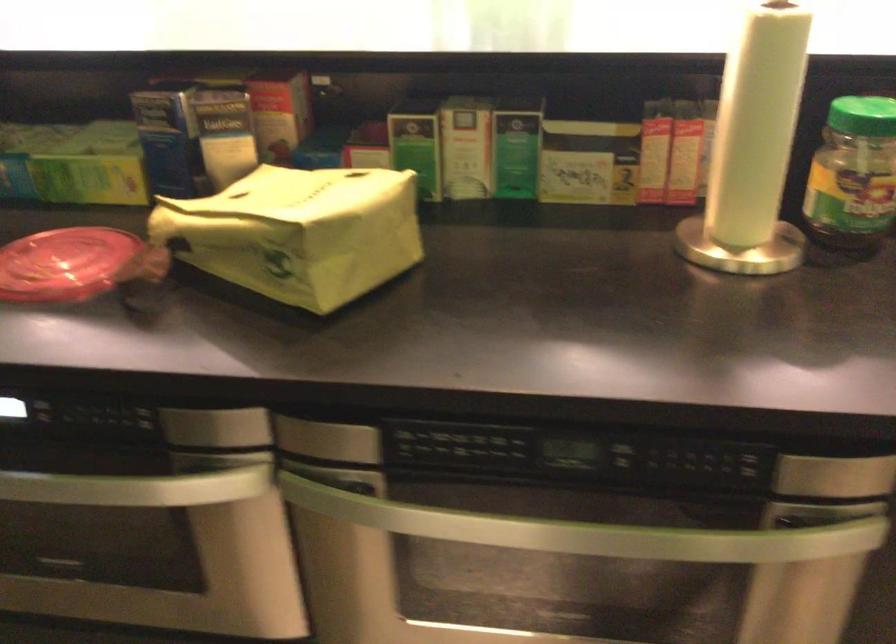
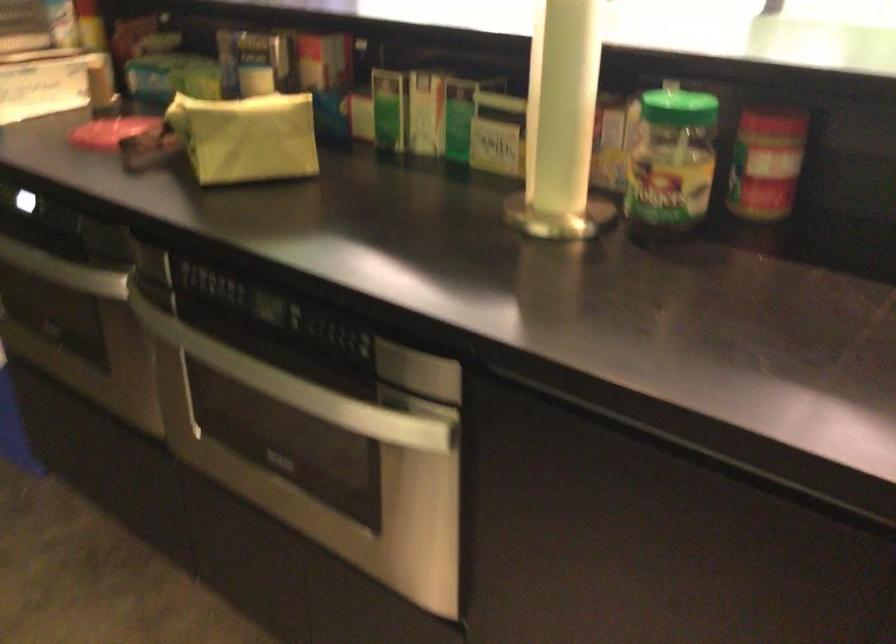
Where in the second image is the point corresponding to point 668,540 from the first image?

(297, 386)